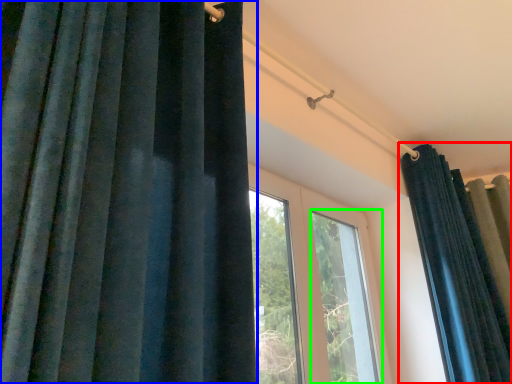
Question: Estimate the real-world distances between objects in this image. Which object is farther from curtain (highlighted by a red box), curtain (highlighted by a blue box) or window (highlighted by a green box)?

Choices:
 (A) curtain
 (B) window

Answer: (A)